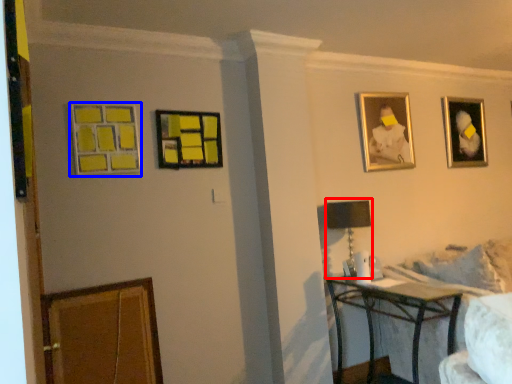
Question: Which point is further to the camera, table lamp (highlighted by a red box) or picture frame (highlighted by a blue box)?

Choices:
 (A) table lamp
 (B) picture frame

Answer: (A)